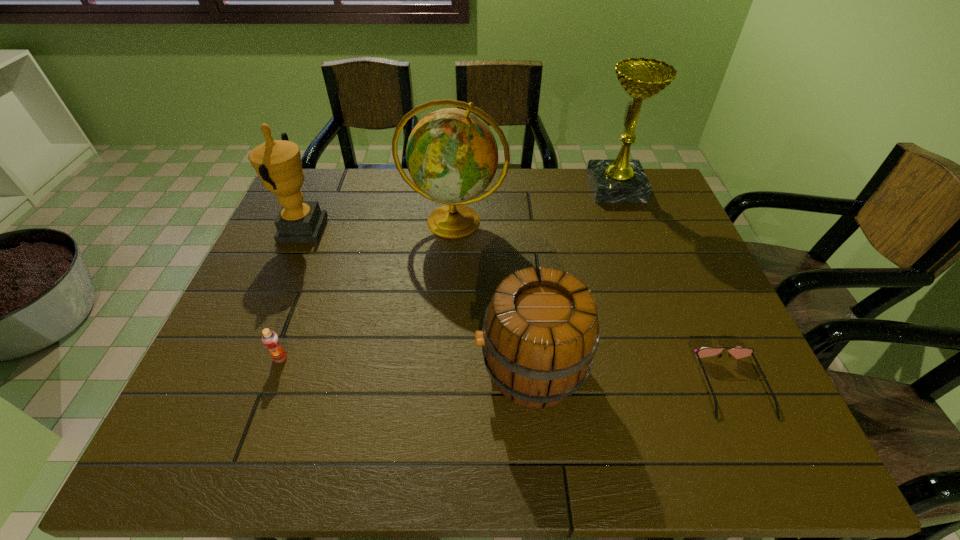
Locate an element on the screen. This screenshot has width=960, height=540. the right award is located at coordinates (622, 180).

Find the location of a particular element. This screenshot has width=960, height=540. globe is located at coordinates (452, 156).

The height and width of the screenshot is (540, 960). I want to click on the nearer award, so click(x=278, y=163).

Locate an element on the screen. Image resolution: width=960 pixels, height=540 pixels. the shorter award is located at coordinates (278, 163).

Identify the location of cider. The width and height of the screenshot is (960, 540). (540, 333).

You are a GUI agent. You are given a task and a screenshot of the screen. Output one action in this format:
    pyautogui.click(x=<x>, y=<y>)
    Task: Click on the second shortest object
    
    Given the screenshot: What is the action you would take?
    pyautogui.click(x=270, y=339)

I want to click on sunglasses, so click(x=738, y=352).

Find the location of a particular element. free space located on the front-facing side of the right award is located at coordinates (490, 187).

Locate an element on the screen. Image resolution: width=960 pixels, height=540 pixels. blank space located on the front-facing side of the right award is located at coordinates (557, 187).

Where is `blank space located on the front-facing side of the right award`? The width and height of the screenshot is (960, 540). blank space located on the front-facing side of the right award is located at coordinates (563, 187).